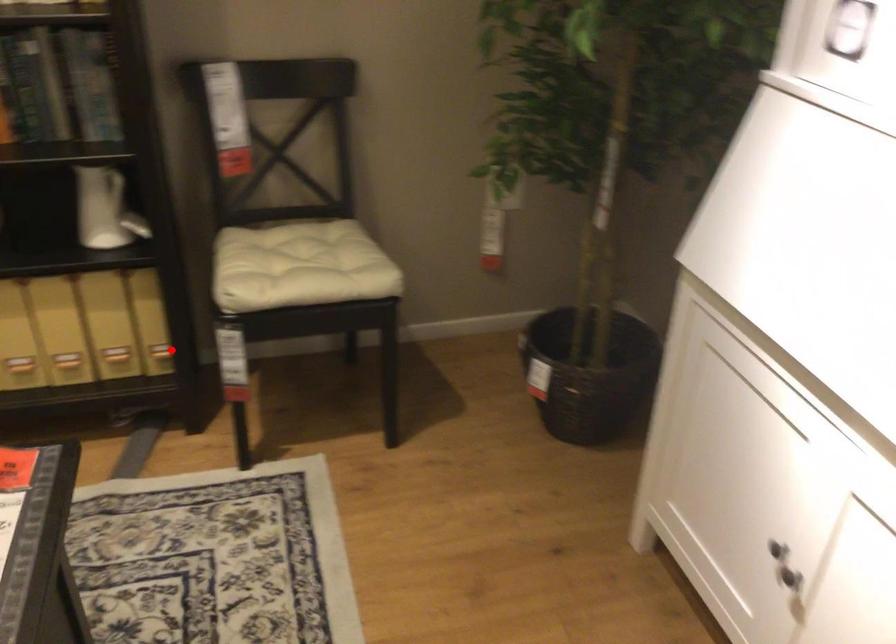
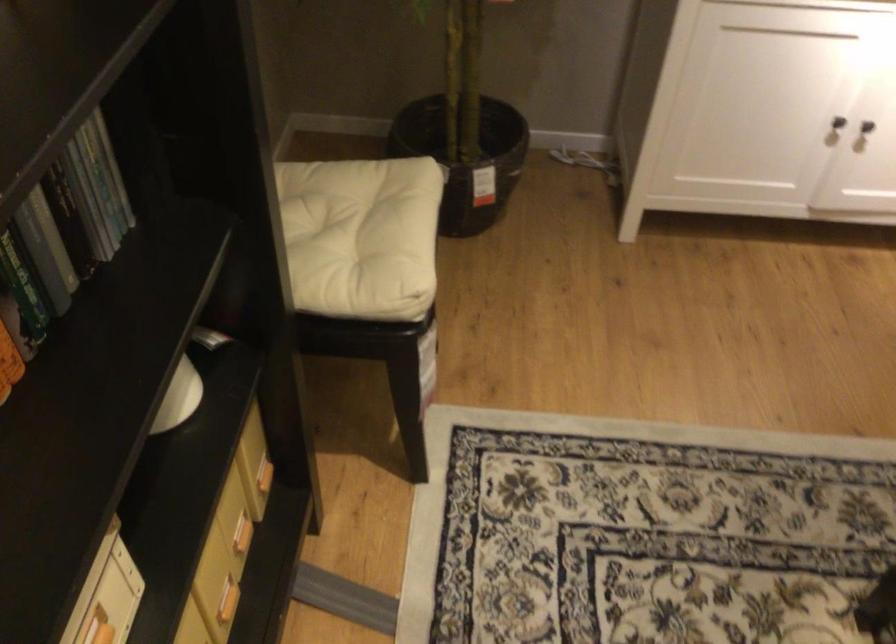
The point at the highlighted location is marked in the first image. Where is the corresponding point in the second image?

(263, 476)